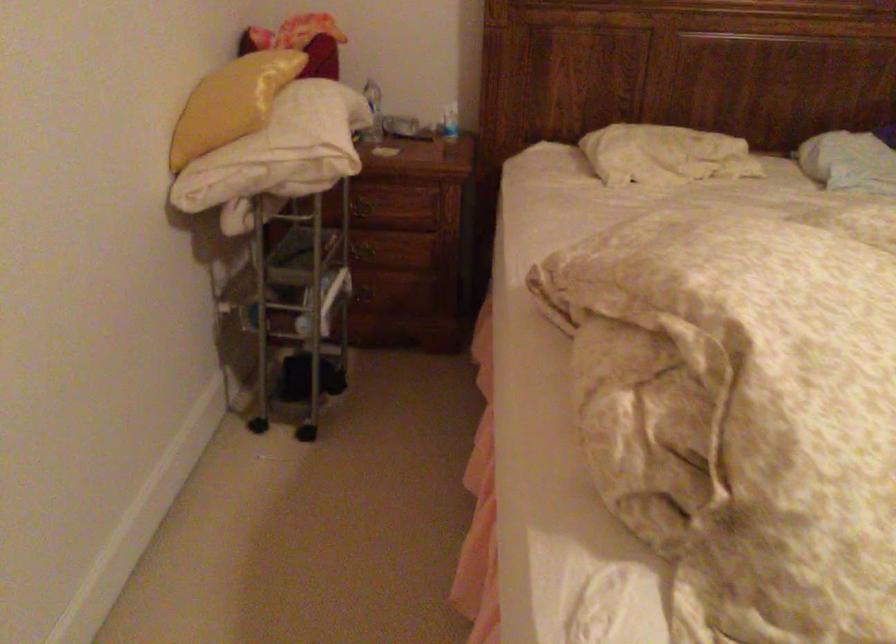
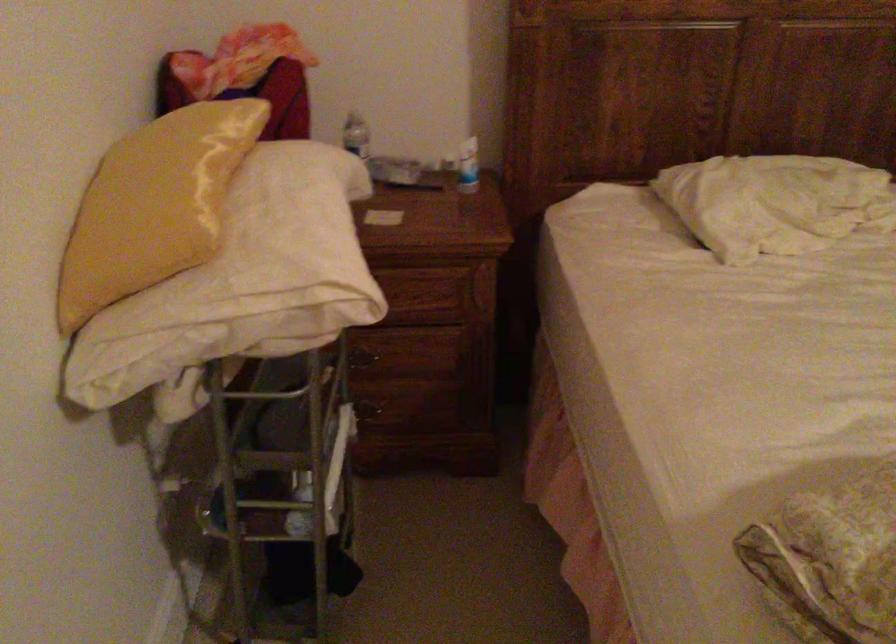
The point at (402, 261) is marked in the first image. Where is the corresponding point in the second image?

(412, 365)